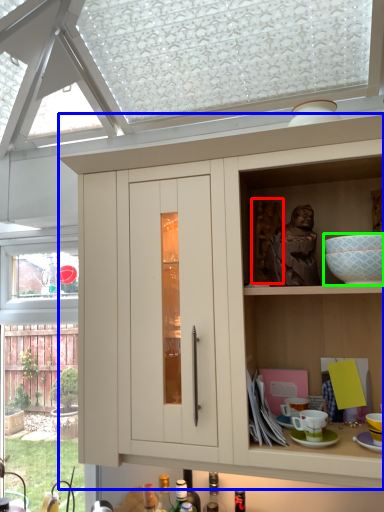
Question: Based on their relative distances, which object is farther from sculpture (highlighted by a red box)? Choose from cabinetry (highlighted by a blue box) and mixing bowl (highlighted by a green box).

Choices:
 (A) cabinetry
 (B) mixing bowl

Answer: (A)